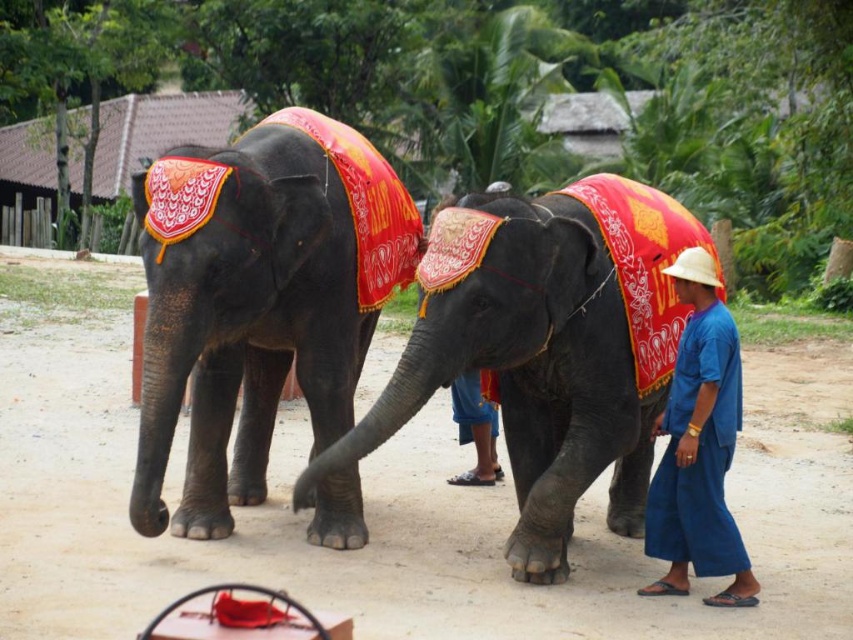
Between brown dirt track at center and shiny red clothed elephant at center, which one is positioned higher?

shiny red clothed elephant at center

Between brown dirt track at center and shiny red clothed elephant at center, which one has more height?

Standing taller between the two is shiny red clothed elephant at center.

What do you see at coordinates (401, 516) in the screenshot? I see `brown dirt track at center` at bounding box center [401, 516].

Where is `brown dirt track at center`? This screenshot has width=853, height=640. brown dirt track at center is located at coordinates (401, 516).

Between point (306, 321) and point (648, 204), which one is positioned in front?

Point (306, 321) is in front.

Can you confirm if shiny black elephant at center is positioned above shiny red clothed elephant at center?

Yes, shiny black elephant at center is above shiny red clothed elephant at center.

Is point (175, 406) positioned before point (625, 531)?

Yes.

Identify the location of shiny black elephant at center. (258, 300).

Between brown dirt track at center and blue cotton pants at lower right, which one has more height?

blue cotton pants at lower right

In the scene shown: Which is more to the left, brown dirt track at center or blue cotton pants at lower right?

brown dirt track at center

The width and height of the screenshot is (853, 640). Find the location of `brown dirt track at center`. brown dirt track at center is located at coordinates (401, 516).